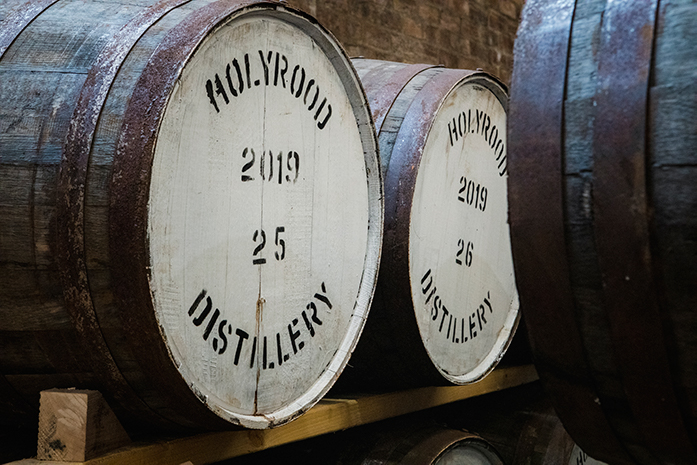
Find the location of a particular element. The height and width of the screenshot is (465, 697). brick wall is located at coordinates (431, 40).